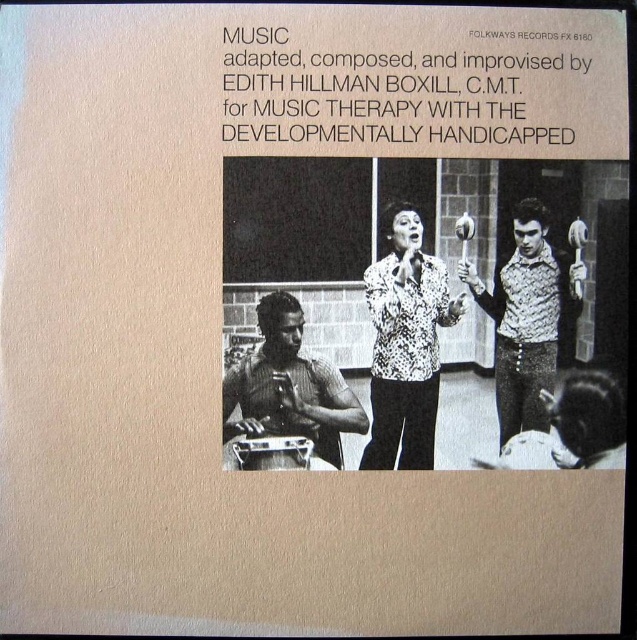
Between point (543, 316) and point (296, 372), which one is positioned in front?

Point (543, 316)

Image resolution: width=637 pixels, height=640 pixels. In order to click on patterned fabric vest at right in this screenshot , I will do `click(527, 317)`.

Looking at this image, is spotted patterned shirt at center taller than metallic drum at lower left?

Correct, spotted patterned shirt at center is much taller as metallic drum at lower left.

Between spotted patterned shirt at center and metallic drum at lower left, which one appears on the left side from the viewer's perspective?

Positioned to the left is metallic drum at lower left.

Find the location of a particular element. This screenshot has height=640, width=637. spotted patterned shirt at center is located at coordinates (404, 346).

Find the location of `spotted patterned shirt at center`. spotted patterned shirt at center is located at coordinates (404, 346).

Can you confirm if spotted patterned shirt at center is positioned below patterned fabric vest at right?

Correct, spotted patterned shirt at center is located below patterned fabric vest at right.

Between point (413, 381) and point (497, 424), which one is positioned in front?

Point (497, 424)

Identify the location of spotted patterned shirt at center. (404, 346).